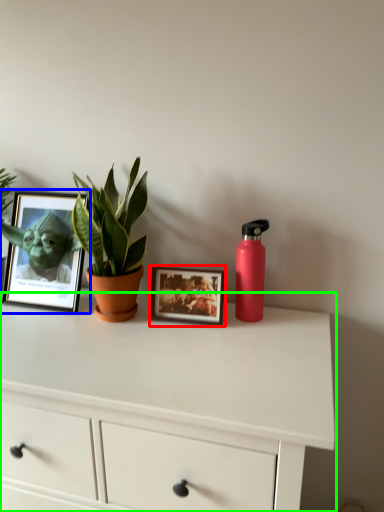
Question: Based on their relative distances, which object is nearer to picture frame (highlighted by a red box)? Choose from picture frame (highlighted by a blue box) and chest of drawers (highlighted by a green box).

Choices:
 (A) picture frame
 (B) chest of drawers

Answer: (B)